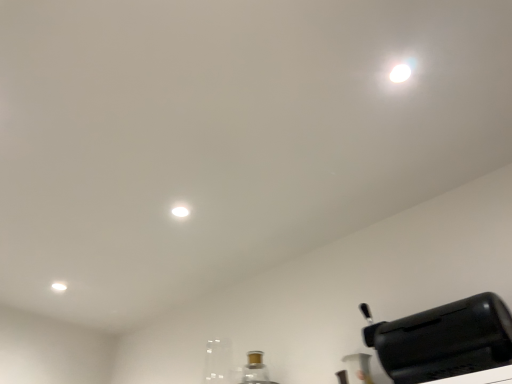
Question: Considering the positions of black plastic toaster at lower right and matte white light at upper left in the image, is black plastic toaster at lower right wider or thinner than matte white light at upper left?

Choices:
 (A) wide
 (B) thin

Answer: (A)

Question: Is black plastic toaster at lower right situated inside matte white light at upper left or outside?

Choices:
 (A) inside
 (B) outside

Answer: (B)

Question: From a real-world perspective, is black plastic toaster at lower right positioned above or below matte white light at upper left?

Choices:
 (A) above
 (B) below

Answer: (B)

Question: From the image's perspective, is matte white light at upper left positioned above or below black plastic toaster at lower right?

Choices:
 (A) above
 (B) below

Answer: (B)

Question: Is matte white light at upper left wider or thinner than black plastic toaster at lower right?

Choices:
 (A) thin
 (B) wide

Answer: (A)

Question: Based on their positions, is matte white light at upper left located to the left or right of black plastic toaster at lower right?

Choices:
 (A) left
 (B) right

Answer: (A)

Question: Is point (64, 283) positioned closer to the camera than point (400, 319)?

Choices:
 (A) closer
 (B) farther

Answer: (B)